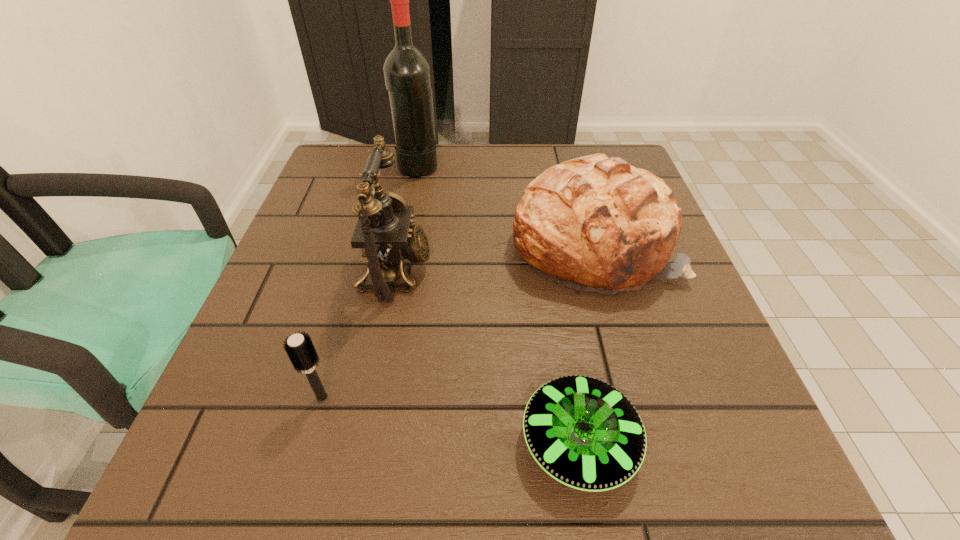
At what (x,y) coordinates should I click in order to perform the action: click on vacant region between the bread and the telephone. Please return your answer as a coordinate pair (x, y). Looking at the image, I should click on (494, 258).

The height and width of the screenshot is (540, 960). I want to click on free space between the tallest object and the third shortest object, so click(506, 206).

You are a GUI agent. You are given a task and a screenshot of the screen. Output one action in this format:
    pyautogui.click(x=<x>, y=<y>)
    Task: Click on the empty space between the wine bottle and the bread
    This screenshot has height=540, width=960.
    Given the screenshot: What is the action you would take?
    pyautogui.click(x=506, y=206)

Locate an element on the screen. vacant area that lies between the saucer and the hairbrush is located at coordinates (451, 420).

At what (x,y) coordinates should I click in order to perform the action: click on free space between the saucer and the fourth tallest object. Please return your answer as a coordinate pair (x, y). Looking at the image, I should click on (451, 420).

Locate an element on the screen. unoccupied position between the fourth shortest object and the bread is located at coordinates (494, 258).

Find the location of a particular element. This screenshot has width=960, height=540. vacant area between the third shortest object and the wine bottle is located at coordinates (506, 206).

Identify the location of unoccupied position between the wine bottle and the second shortest object. (371, 281).

At what (x,y) coordinates should I click in order to perform the action: click on free space between the shortest object and the tallest object. Please return your answer as a coordinate pair (x, y). This screenshot has width=960, height=540. Looking at the image, I should click on (498, 303).

Where is `free space between the saucer and the second shortest object`? Image resolution: width=960 pixels, height=540 pixels. free space between the saucer and the second shortest object is located at coordinates (451, 420).